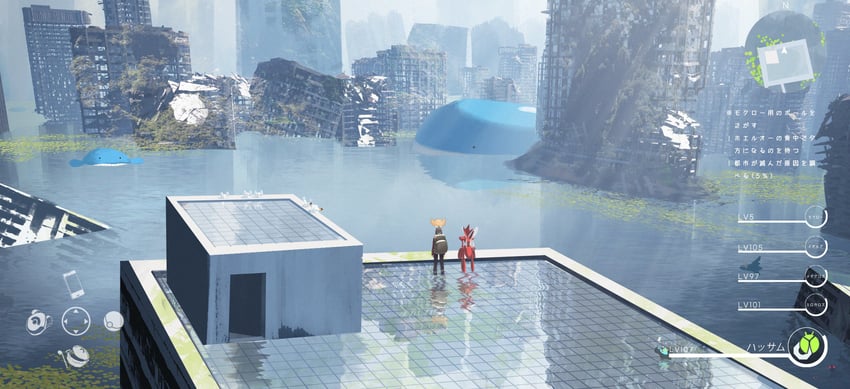
Locate an element on the screen. door is located at coordinates (244, 310).